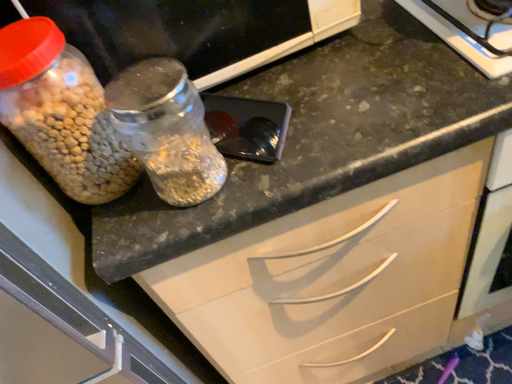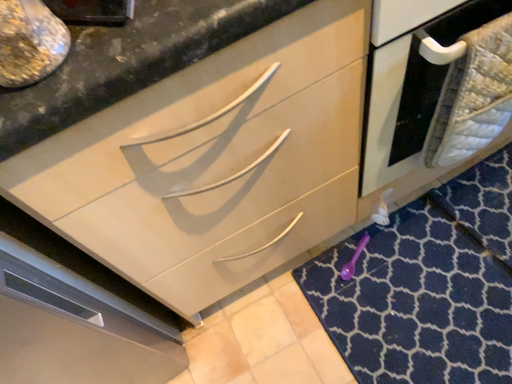
Question: Which way did the camera rotate in the video?

Choices:
 (A) rotated left
 (B) rotated right

Answer: (B)